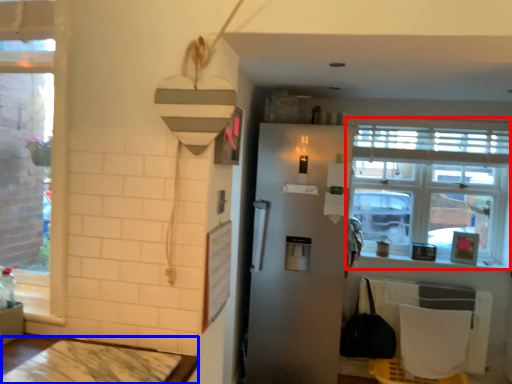
Question: Which point is further to the camera, window (highlighted by a red box) or table (highlighted by a blue box)?

Choices:
 (A) window
 (B) table

Answer: (A)